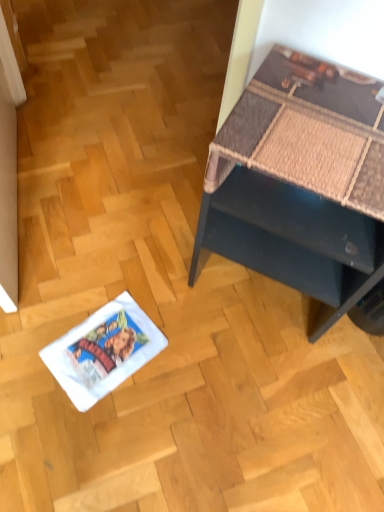
The width and height of the screenshot is (384, 512). I want to click on vacant area situated below white paper comic book at lower left (from a real-world perspective), so click(102, 344).